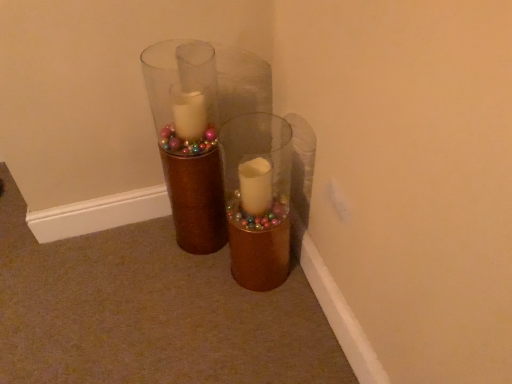
Locate an element on the screen. This screenshot has width=512, height=384. brown textured vase at center, which is counted as the 2th vase, starting from the left is located at coordinates (258, 198).

This screenshot has height=384, width=512. What do you see at coordinates (258, 198) in the screenshot?
I see `brown textured vase at center, the first vase when ordered from right to left` at bounding box center [258, 198].

Locate an element on the screen. The image size is (512, 384). gold glitter vase at center, acting as the 1th vase starting from the left is located at coordinates (188, 139).

This screenshot has width=512, height=384. Describe the element at coordinates (188, 139) in the screenshot. I see `gold glitter vase at center, acting as the 1th vase starting from the left` at that location.

I want to click on brown textured vase at center, which is counted as the 2th vase, starting from the left, so click(258, 198).

Is gold glitter vase at center, which is the 2th vase in right-to-left order, to the left of brown textured vase at center, the first vase when ordered from right to left, from the viewer's perspective?

Yes.

Between gold glitter vase at center, acting as the 1th vase starting from the left, and brown textured vase at center, the first vase when ordered from right to left, which one is positioned behind?

Positioned behind is gold glitter vase at center, acting as the 1th vase starting from the left.

Does point (208, 195) lie in front of point (278, 209)?

No, it is behind (278, 209).

Based on the photo, from the image's perspective, is gold glitter vase at center, which is the 2th vase in right-to-left order, located above or below brown textured vase at center, the first vase when ordered from right to left?

Based on their image positions, gold glitter vase at center, which is the 2th vase in right-to-left order, is located above brown textured vase at center, the first vase when ordered from right to left.

From a real-world perspective, who is located higher, gold glitter vase at center, which is the 2th vase in right-to-left order, or brown textured vase at center, which is counted as the 2th vase, starting from the left?

gold glitter vase at center, which is the 2th vase in right-to-left order, from a real-world perspective.

Between gold glitter vase at center, acting as the 1th vase starting from the left, and brown textured vase at center, the first vase when ordered from right to left, which one has smaller width?

brown textured vase at center, the first vase when ordered from right to left, is thinner.

Does gold glitter vase at center, which is the 2th vase in right-to-left order, have a lesser height compared to brown textured vase at center, which is counted as the 2th vase, starting from the left?

No.

Considering the relative sizes of gold glitter vase at center, which is the 2th vase in right-to-left order, and brown textured vase at center, the first vase when ordered from right to left, in the image provided, is gold glitter vase at center, which is the 2th vase in right-to-left order, smaller than brown textured vase at center, the first vase when ordered from right to left,?

Incorrect, gold glitter vase at center, which is the 2th vase in right-to-left order, is not smaller in size than brown textured vase at center, the first vase when ordered from right to left.

From the picture: Is gold glitter vase at center, acting as the 1th vase starting from the left, not inside brown textured vase at center, the first vase when ordered from right to left?

gold glitter vase at center, acting as the 1th vase starting from the left, is positioned outside brown textured vase at center, the first vase when ordered from right to left.

In the scene shown: Are gold glitter vase at center, acting as the 1th vase starting from the left, and brown textured vase at center, which is counted as the 2th vase, starting from the left, located far from each other?

No.

From the picture: Is gold glitter vase at center, acting as the 1th vase starting from the left, oriented towards brown textured vase at center, the first vase when ordered from right to left?

No, gold glitter vase at center, acting as the 1th vase starting from the left, is not turned towards brown textured vase at center, the first vase when ordered from right to left.

Where is `vase on the right of gold glitter vase at center, acting as the 1th vase starting from the left`? Image resolution: width=512 pixels, height=384 pixels. vase on the right of gold glitter vase at center, acting as the 1th vase starting from the left is located at coordinates (258, 198).

Considering the relative positions of brown textured vase at center, which is counted as the 2th vase, starting from the left, and gold glitter vase at center, which is the 2th vase in right-to-left order, in the image provided, is brown textured vase at center, which is counted as the 2th vase, starting from the left, to the left of gold glitter vase at center, which is the 2th vase in right-to-left order, from the viewer's perspective?

Incorrect, brown textured vase at center, which is counted as the 2th vase, starting from the left, is not on the left side of gold glitter vase at center, which is the 2th vase in right-to-left order.

Is brown textured vase at center, the first vase when ordered from right to left, positioned in front of gold glitter vase at center, which is the 2th vase in right-to-left order?

Yes, brown textured vase at center, the first vase when ordered from right to left, is closer to the camera.

Is point (234, 216) closer or farther from the camera than point (195, 208)?

Clearly, point (234, 216) is closer to the camera than point (195, 208).

From the image's perspective, is brown textured vase at center, the first vase when ordered from right to left, beneath gold glitter vase at center, acting as the 1th vase starting from the left?

Indeed, from the image's perspective, brown textured vase at center, the first vase when ordered from right to left, is shown beneath gold glitter vase at center, acting as the 1th vase starting from the left.

From a real-world perspective, which is physically above, brown textured vase at center, the first vase when ordered from right to left, or gold glitter vase at center, which is the 2th vase in right-to-left order?

From a 3D spatial view, gold glitter vase at center, which is the 2th vase in right-to-left order, is above.

Which object is thinner, brown textured vase at center, the first vase when ordered from right to left, or gold glitter vase at center, acting as the 1th vase starting from the left?

Thinner between the two is brown textured vase at center, the first vase when ordered from right to left.

Does brown textured vase at center, the first vase when ordered from right to left, have a lesser height compared to gold glitter vase at center, which is the 2th vase in right-to-left order?

Correct, brown textured vase at center, the first vase when ordered from right to left, is not as tall as gold glitter vase at center, which is the 2th vase in right-to-left order.

Does brown textured vase at center, the first vase when ordered from right to left, have a smaller size compared to gold glitter vase at center, acting as the 1th vase starting from the left?

Indeed, brown textured vase at center, the first vase when ordered from right to left, has a smaller size compared to gold glitter vase at center, acting as the 1th vase starting from the left.

Consider the image. Can gold glitter vase at center, which is the 2th vase in right-to-left order, be found inside brown textured vase at center, the first vase when ordered from right to left?

No, gold glitter vase at center, which is the 2th vase in right-to-left order, is not inside brown textured vase at center, the first vase when ordered from right to left.

Does brown textured vase at center, which is counted as the 2th vase, starting from the left, turn towards gold glitter vase at center, which is the 2th vase in right-to-left order?

No, brown textured vase at center, which is counted as the 2th vase, starting from the left, is not turned towards gold glitter vase at center, which is the 2th vase in right-to-left order.

Could you measure the distance between brown textured vase at center, the first vase when ordered from right to left, and gold glitter vase at center, which is the 2th vase in right-to-left order?

A distance of 7.92 inches exists between brown textured vase at center, the first vase when ordered from right to left, and gold glitter vase at center, which is the 2th vase in right-to-left order.

Where is `vase that appears behind the brown textured vase at center, the first vase when ordered from right to left`? vase that appears behind the brown textured vase at center, the first vase when ordered from right to left is located at coordinates (188, 139).

The image size is (512, 384). What are the coordinates of `vase above the brown textured vase at center, the first vase when ordered from right to left (from the image's perspective)` in the screenshot? It's located at (188, 139).

Identify the location of vase on the left side of brown textured vase at center, the first vase when ordered from right to left. (188, 139).